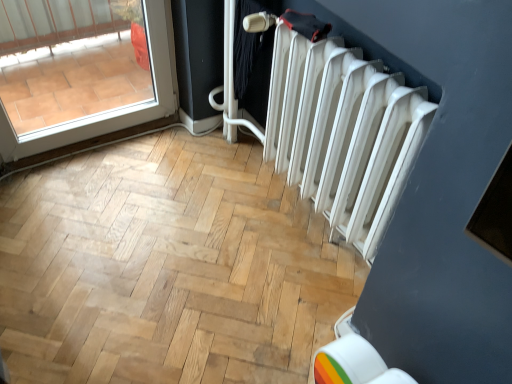
The image size is (512, 384). Describe the element at coordinates (339, 130) in the screenshot. I see `white matte radiator at right` at that location.

This screenshot has height=384, width=512. What are the coordinates of `white matte radiator at right` in the screenshot? It's located at (339, 130).

What do you see at coordinates (108, 112) in the screenshot? The width and height of the screenshot is (512, 384). I see `transparent glass door at upper left` at bounding box center [108, 112].

Find the location of a particular element. This screenshot has width=512, height=384. transparent glass door at upper left is located at coordinates (108, 112).

The image size is (512, 384). I want to click on white matte radiator at right, so click(339, 130).

Is transparent glass door at upper left at the left side of white matte radiator at right?

Indeed, transparent glass door at upper left is positioned on the left side of white matte radiator at right.

Considering the positions of objects transparent glass door at upper left and white matte radiator at right in the image provided, who is behind, transparent glass door at upper left or white matte radiator at right?

transparent glass door at upper left is more distant.

Is point (135, 111) positioned before point (296, 57)?

That is False.

Consider the image. From the image's perspective, which one is positioned lower, transparent glass door at upper left or white matte radiator at right?

white matte radiator at right, from the image's perspective.

From a real-world perspective, which is physically above, transparent glass door at upper left or white matte radiator at right?

In real-world perspective, white matte radiator at right is above.

Can you confirm if transparent glass door at upper left is wider than white matte radiator at right?

In fact, transparent glass door at upper left might be narrower than white matte radiator at right.

From their relative heights in the image, would you say transparent glass door at upper left is taller or shorter than white matte radiator at right?

Clearly, transparent glass door at upper left is shorter compared to white matte radiator at right.

Consider the image. Based on their sizes in the image, would you say transparent glass door at upper left is bigger or smaller than white matte radiator at right?

transparent glass door at upper left is smaller than white matte radiator at right.

Would you say transparent glass door at upper left is outside white matte radiator at right?

Yes, transparent glass door at upper left is not within white matte radiator at right.

Would you say transparent glass door at upper left is a long distance from white matte radiator at right?

transparent glass door at upper left is actually quite close to white matte radiator at right.

Is transparent glass door at upper left turned away from white matte radiator at right?

transparent glass door at upper left does not have its back to white matte radiator at right.

How many degrees apart are the facing directions of transparent glass door at upper left and white matte radiator at right?

They differ by 87.7 degrees in their facing directions.

The width and height of the screenshot is (512, 384). In order to click on radiator lying in front of the transparent glass door at upper left in this screenshot , I will do `click(339, 130)`.

Considering the relative positions of white matte radiator at right and transparent glass door at upper left in the image provided, is white matte radiator at right to the left of transparent glass door at upper left from the viewer's perspective?

No.

Is the position of white matte radiator at right less distant than that of transparent glass door at upper left?

Yes, it is.

Considering the points (380, 131) and (6, 140), which point is behind, point (380, 131) or point (6, 140)?

The point (6, 140) is farther from the camera.

From the image's perspective, is white matte radiator at right located above transparent glass door at upper left?

No, from the image's perspective, white matte radiator at right is not on top of transparent glass door at upper left.

From a real-world perspective, who is located lower, white matte radiator at right or transparent glass door at upper left?

From a 3D spatial view, transparent glass door at upper left is below.

Is white matte radiator at right thinner than transparent glass door at upper left?

Incorrect, the width of white matte radiator at right is not less than that of transparent glass door at upper left.

Considering the sizes of objects white matte radiator at right and transparent glass door at upper left in the image provided, who is taller, white matte radiator at right or transparent glass door at upper left?

white matte radiator at right.

Between white matte radiator at right and transparent glass door at upper left, which one has smaller size?

With smaller size is transparent glass door at upper left.

Would you say white matte radiator at right is outside transparent glass door at upper left?

That's correct, white matte radiator at right is outside of transparent glass door at upper left.

Is white matte radiator at right touching transparent glass door at upper left?

They are not placed beside each other.

Does white matte radiator at right turn towards transparent glass door at upper left?

No, white matte radiator at right does not turn towards transparent glass door at upper left.

Locate an element on the screen. This screenshot has width=512, height=384. radiator in front of the transparent glass door at upper left is located at coordinates (339, 130).

Where is `door beneath the white matte radiator at right (from a real-world perspective)`? door beneath the white matte radiator at right (from a real-world perspective) is located at coordinates (108, 112).

The width and height of the screenshot is (512, 384). Identify the location of radiator above the transparent glass door at upper left (from a real-world perspective). (339, 130).